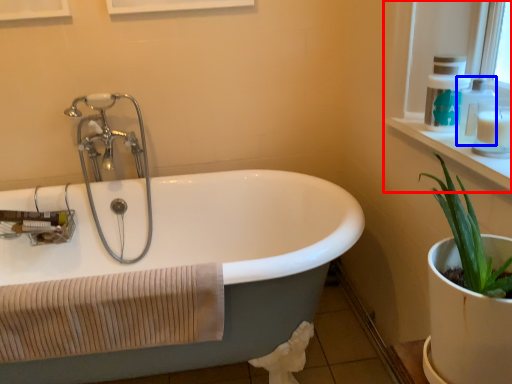
Question: Which object is further to the camera taking this photo, window frame (highlighted by a red box) or soap dispenser (highlighted by a blue box)?

Choices:
 (A) window frame
 (B) soap dispenser

Answer: (B)